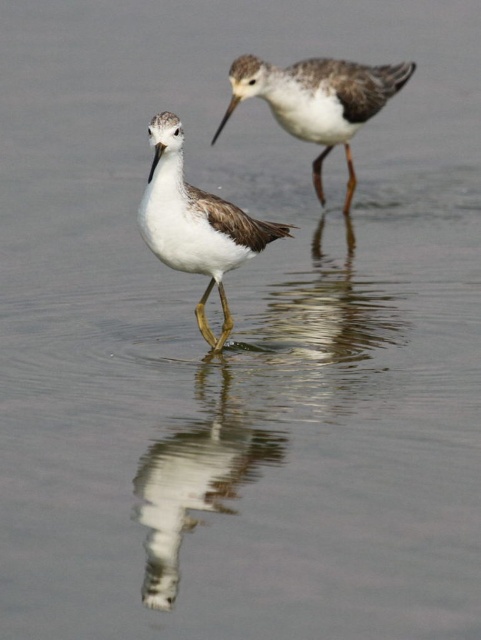
Does white glossy bird reflection at center appear over white matte bird at upper center?

No, white glossy bird reflection at center is not above white matte bird at upper center.

Can you confirm if white glossy bird reflection at center is positioned below white matte bird at upper center?

Yes.

Which is behind, point (150, 486) or point (279, 90)?

Point (279, 90)

Locate an element on the screen. white glossy bird reflection at center is located at coordinates (194, 481).

Is point (254, 340) less distant than point (248, 452)?

No.

Image resolution: width=481 pixels, height=640 pixels. I want to click on white glossy bird at center, so click(254, 397).

Does white glossy bird at center have a lesser height compared to white matte bird at center?

Incorrect, white glossy bird at center's height does not fall short of white matte bird at center's.

Is point (177, 422) closer to viewer compared to point (165, 118)?

No, (177, 422) is behind (165, 118).

Identify the location of white glossy bird at center. The image size is (481, 640). (254, 397).